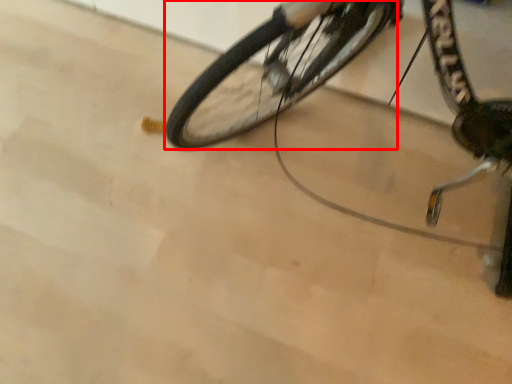
Question: Considering the relative positions of bicycle wheel (annotated by the red box) and bicycle in the image provided, where is bicycle wheel (annotated by the red box) located with respect to the staircase?

Choices:
 (A) left
 (B) right

Answer: (A)